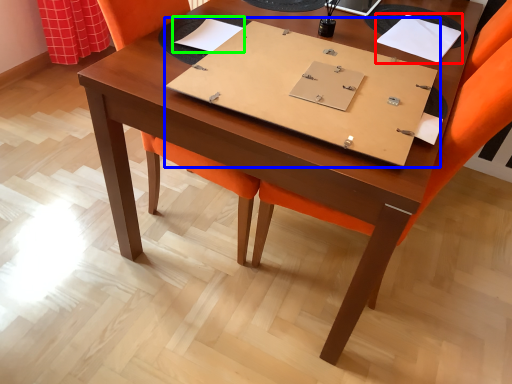
Question: Which object is positioned farthest from notebook (highlighted by a red box)? Select from notebook (highlighted by a blue box) and notebook (highlighted by a green box).

Choices:
 (A) notebook
 (B) notebook

Answer: (B)